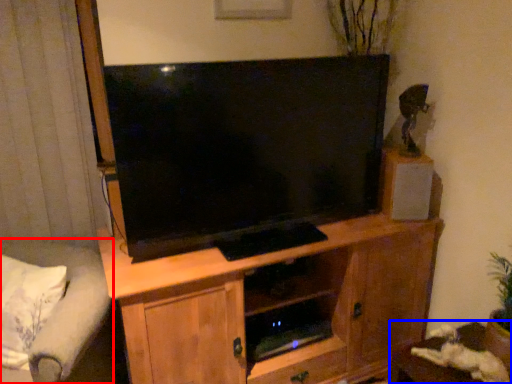
Question: Which object appears farthest to the camera in this image, studio couch (highlighted by a red box) or table (highlighted by a blue box)?

Choices:
 (A) studio couch
 (B) table

Answer: (B)